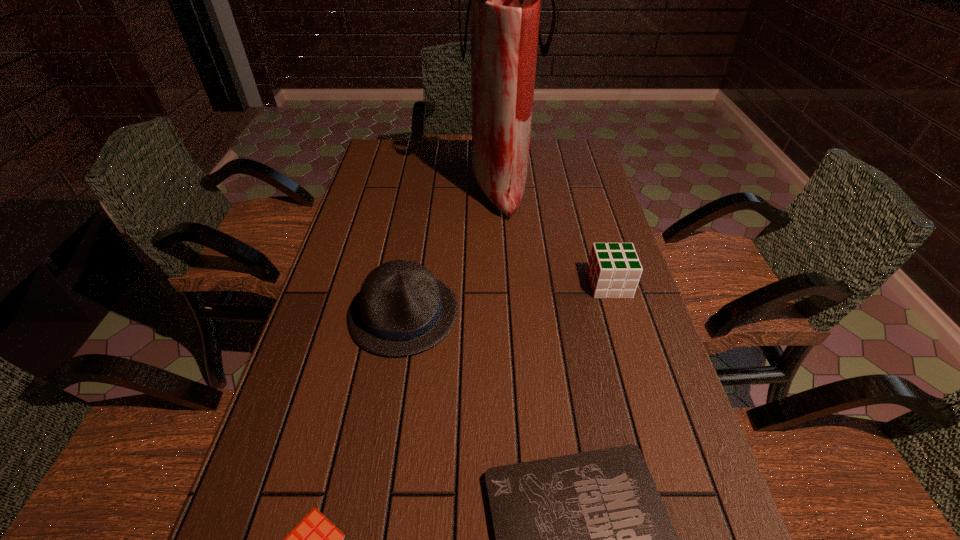
The width and height of the screenshot is (960, 540). In order to click on grocery bag in this screenshot , I will do `click(504, 4)`.

Find the location of `the tallest object`. the tallest object is located at coordinates (504, 4).

Image resolution: width=960 pixels, height=540 pixels. What are the coordinates of `the second tallest object` in the screenshot? It's located at (402, 309).

Find the location of a particular element. The height and width of the screenshot is (540, 960). the farther cube is located at coordinates (614, 270).

Image resolution: width=960 pixels, height=540 pixels. Find the location of `blank area located on the left of the tallest object`. blank area located on the left of the tallest object is located at coordinates (383, 186).

The height and width of the screenshot is (540, 960). I want to click on vacant space situated on the front-facing side of the second tallest object, so click(386, 417).

Where is `vacant space located on the red face of the right cube`? The height and width of the screenshot is (540, 960). vacant space located on the red face of the right cube is located at coordinates (448, 285).

This screenshot has width=960, height=540. In order to click on vacant space located 0.120m on the red face of the right cube in this screenshot , I will do `click(544, 285)`.

The image size is (960, 540). What are the coordinates of `vacant position located 0.220m on the red face of the right cube` in the screenshot? It's located at (506, 285).

At what (x,y) coordinates should I click in order to perform the action: click on object positioned at the far edge. Please return your answer as a coordinate pair (x, y). The height and width of the screenshot is (540, 960). Looking at the image, I should click on [x=504, y=4].